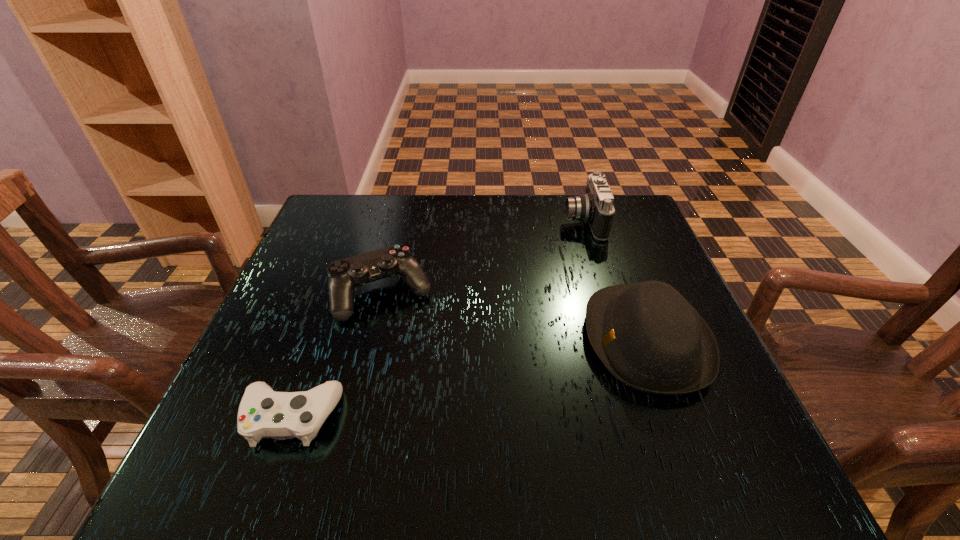
Image resolution: width=960 pixels, height=540 pixels. Find the location of `free region that satisfies the following two spatial constraints: 1. on the front-facing side of the camera; 2. on the front side of the second shortest object`. free region that satisfies the following two spatial constraints: 1. on the front-facing side of the camera; 2. on the front side of the second shortest object is located at coordinates (606, 294).

Identify the location of free space that satisfies the following two spatial constraints: 1. on the front-facing side of the camera; 2. on the front side of the taller control. This screenshot has height=540, width=960. (606, 294).